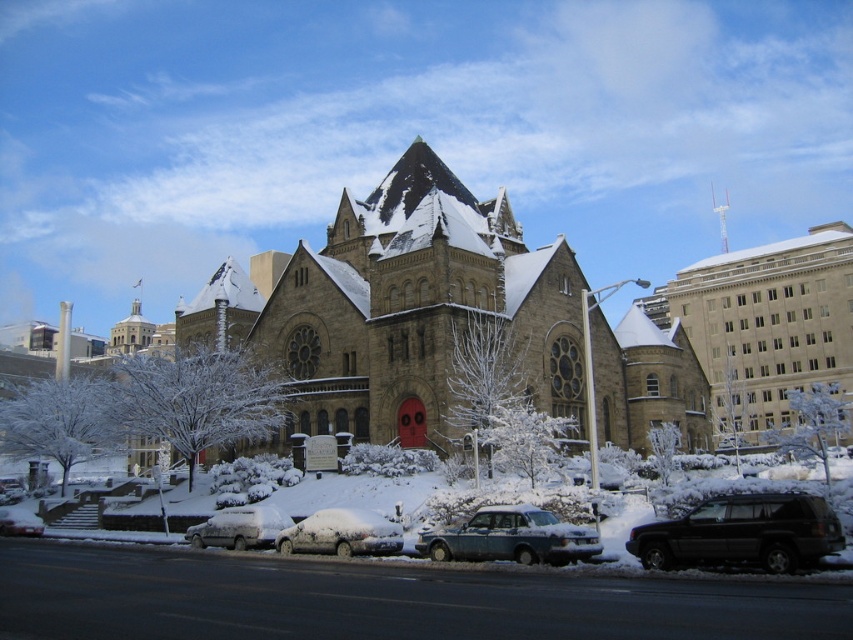
Based on the photo, between beige stone church at center and black matte suv at lower right, which one is positioned higher?

beige stone church at center

Between point (714, 346) and point (811, 529), which one is positioned in front?

Point (811, 529) is more forward.

Between point (747, 266) and point (715, 536), which one is positioned behind?

The point (747, 266) is behind.

Locate an element on the screen. This screenshot has height=640, width=853. beige stone church at center is located at coordinates (769, 326).

Is snow-covered sedan at center to the right of snow-covered sedan at lower center from the viewer's perspective?

Yes, snow-covered sedan at center is to the right of snow-covered sedan at lower center.

Is point (583, 547) closer to camera compared to point (303, 525)?

Yes, it is.

I want to click on snow-covered sedan at center, so click(x=511, y=538).

Between black matte suv at lower right and snow-covered sedan at lower center, which one has more height?

black matte suv at lower right is taller.

Does black matte suv at lower right have a lesser width compared to snow-covered sedan at lower center?

In fact, black matte suv at lower right might be wider than snow-covered sedan at lower center.

Is point (788, 525) behind point (343, 524)?

No, (788, 525) is in front of (343, 524).

Image resolution: width=853 pixels, height=640 pixels. What are the coordinates of `black matte suv at lower right` in the screenshot? It's located at (741, 532).